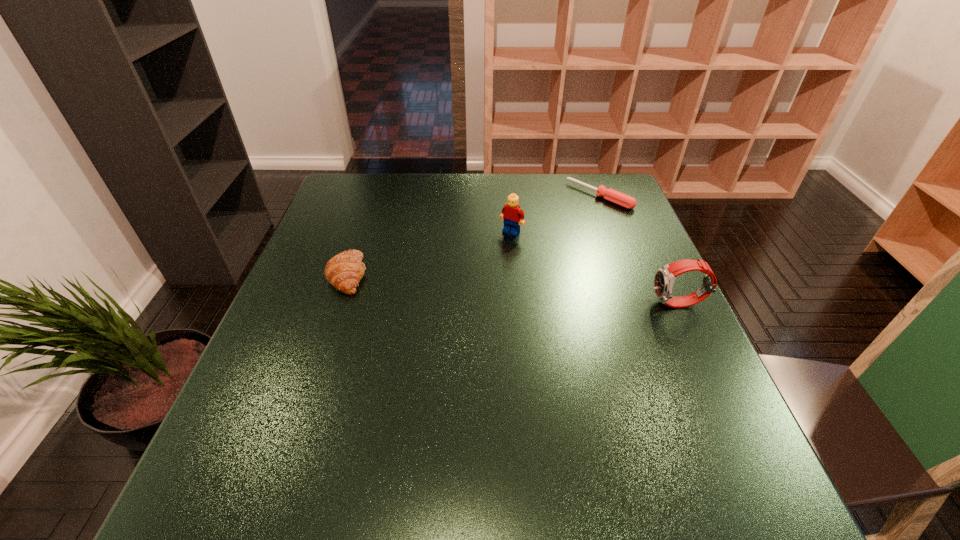
What are the coordinates of `crescent roll` in the screenshot? It's located at (344, 271).

This screenshot has height=540, width=960. What are the coordinates of `the leftmost object` in the screenshot? It's located at (344, 271).

You are a GUI agent. You are given a task and a screenshot of the screen. Output one action in this format:
    pyautogui.click(x=<x>, y=<y>)
    Task: Click on the watch
    
    Given the screenshot: What is the action you would take?
    pyautogui.click(x=664, y=278)

Identify the location of the farthest object. (621, 199).

Image resolution: width=960 pixels, height=540 pixels. I want to click on screwdriver, so click(x=621, y=199).

Identify the location of Lego. (512, 214).

This screenshot has width=960, height=540. I want to click on the second farthest object, so point(512,214).

This screenshot has width=960, height=540. I want to click on vacant space located 0.080m on the right of the crescent roll, so click(400, 275).

Locate an element on the screen. Image resolution: width=960 pixels, height=540 pixels. free space located 0.270m on the face of the watch is located at coordinates pos(537,304).

You are a GUI agent. You are given a task and a screenshot of the screen. Output one action in this format:
    pyautogui.click(x=<x>, y=<y>)
    Task: Click on the vacant region located on the face of the watch
    The image size is (960, 540).
    Given the screenshot: What is the action you would take?
    pyautogui.click(x=493, y=304)